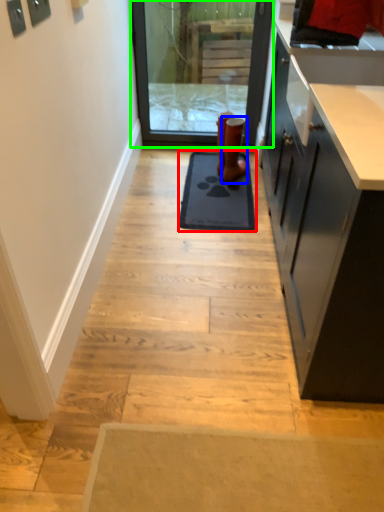
Question: Which is nearer to the mat (highlighted by a red box)? footwear (highlighted by a blue box) or screen door (highlighted by a green box).

Choices:
 (A) footwear
 (B) screen door

Answer: (A)